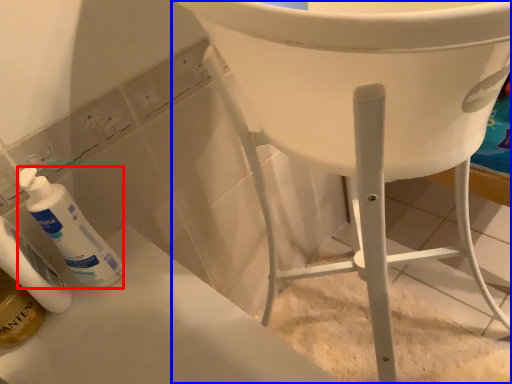
Question: Which object appears closest to the camera in this image, cleaning product (highlighted by a red box) or furniture (highlighted by a blue box)?

Choices:
 (A) cleaning product
 (B) furniture

Answer: (A)